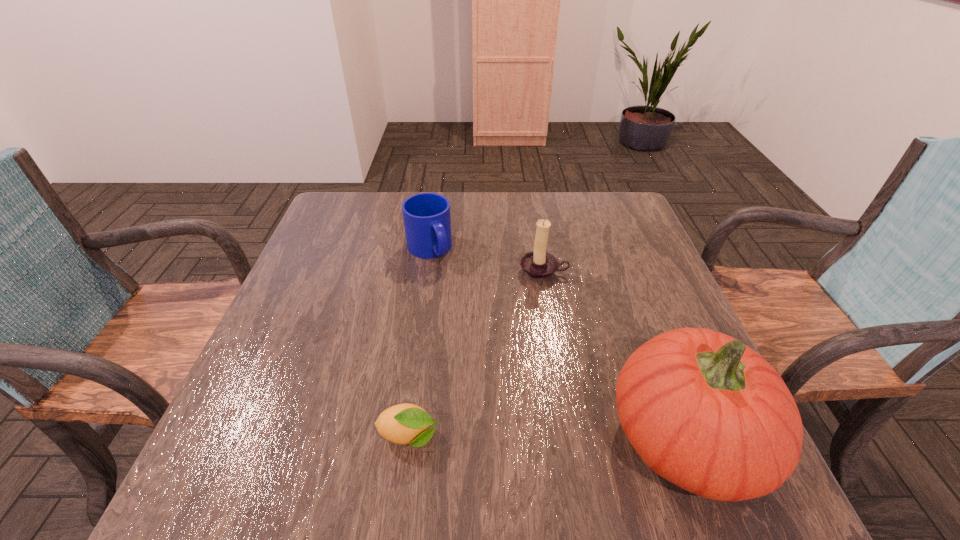
You are a GUI agent. You are given a task and a screenshot of the screen. Output one action in this format:
    pyautogui.click(x=<x>, y=<y>)
    Task: Click on the free space on the desktop that is between the lemon and the pumpkin and is positioned on the side with the handle of the mug
    Image resolution: width=960 pixels, height=540 pixels.
    Given the screenshot: What is the action you would take?
    pyautogui.click(x=555, y=436)

The width and height of the screenshot is (960, 540). I want to click on vacant spot on the desktop that is between the lemon and the pumpkin and is positioned on the wick of the third shortest object, so click(x=525, y=436).